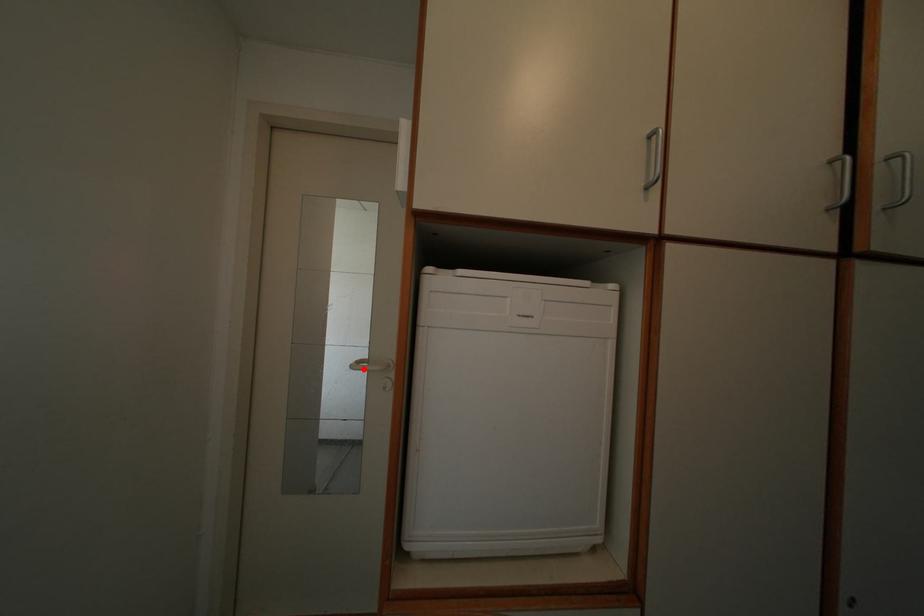
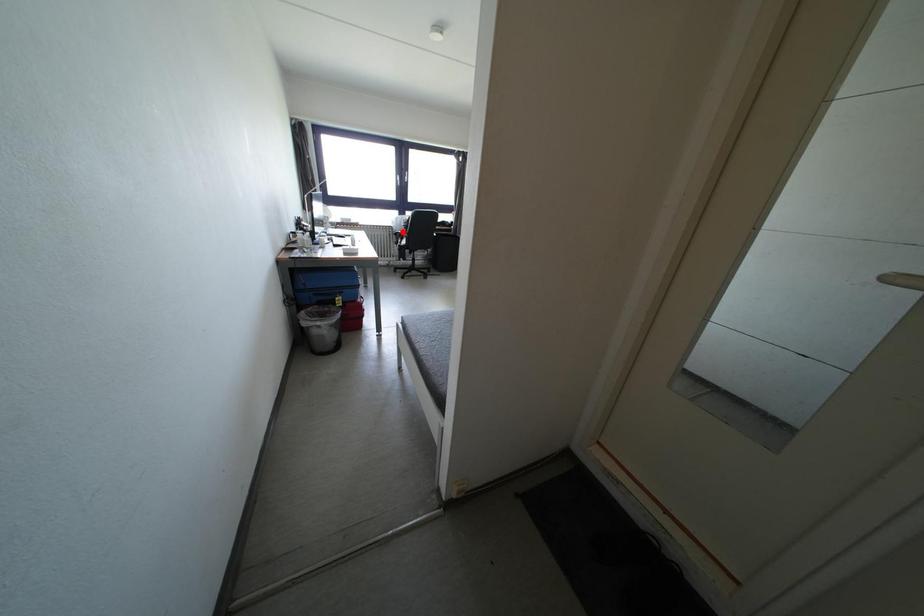
I am providing you with two images of the same scene from different viewpoints. A red point is marked on the first image and another point is marked on the second image. Is the red point in image1 aligned with the point shown in image2?

No